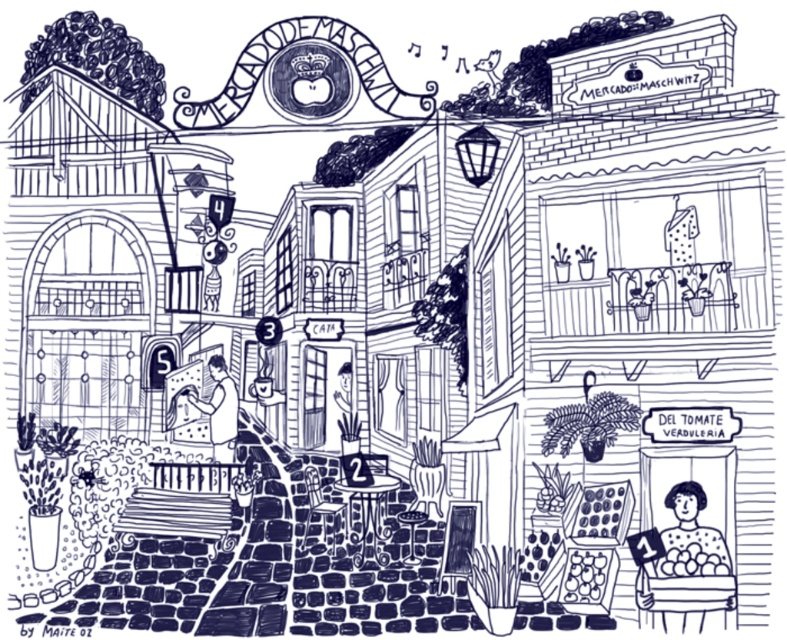
Is point (651, 588) positioned in front of point (233, 412)?

Yes, it is.

Who is positioned more to the left, polka dot dress at lower right or smooth black shirt at center?

smooth black shirt at center is more to the left.

Where is `polka dot dress at lower right`? The height and width of the screenshot is (640, 787). polka dot dress at lower right is located at coordinates (686, 566).